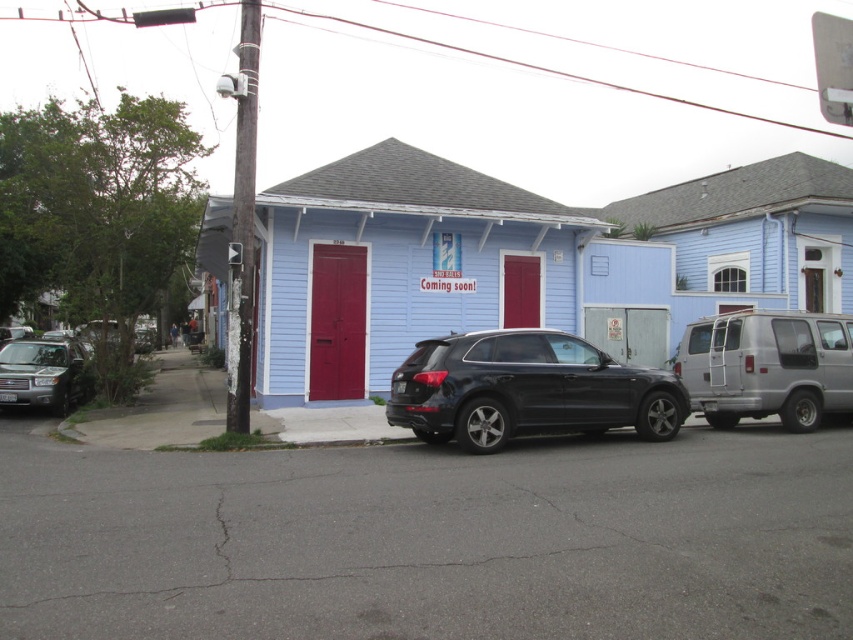
Based on the photo, you are a delivery person trying to decide which vehicle to load a tall package into. The package is 1.8 meters in height. You have the matte black suv at center and the silver metallic suv at left available. Which vehicle can accommodate the package without exceeding its height limit?

The matte black suv at center has a greater height compared to the silver metallic suv at left, so it can accommodate the package without exceeding its height limit.

You are a delivery driver who needs to back out of the parking space between the matte black suv at center and the silver metallic van at right. Can you safely back out without hitting either vehicle?

The matte black suv at center is in front of the silver metallic van at right, so the silver metallic van at right is behind the matte black suv at center. Since the silver metallic van at right is behind the matte black suv at center, you can safely back out without hitting the van. However, you need to ensure there is enough space behind the matte black suv at center to maneuver safely.

You are a delivery driver who needs to park your truck between the silver metallic van at right and the silver metallic suv at left. Your truck is 5 meters long. Is there enough space between them to park your truck?

The distance between the silver metallic van at right and the silver metallic suv at left is 13.65 meters. Since your truck is only 5 meters long, there is sufficient space to park between them.